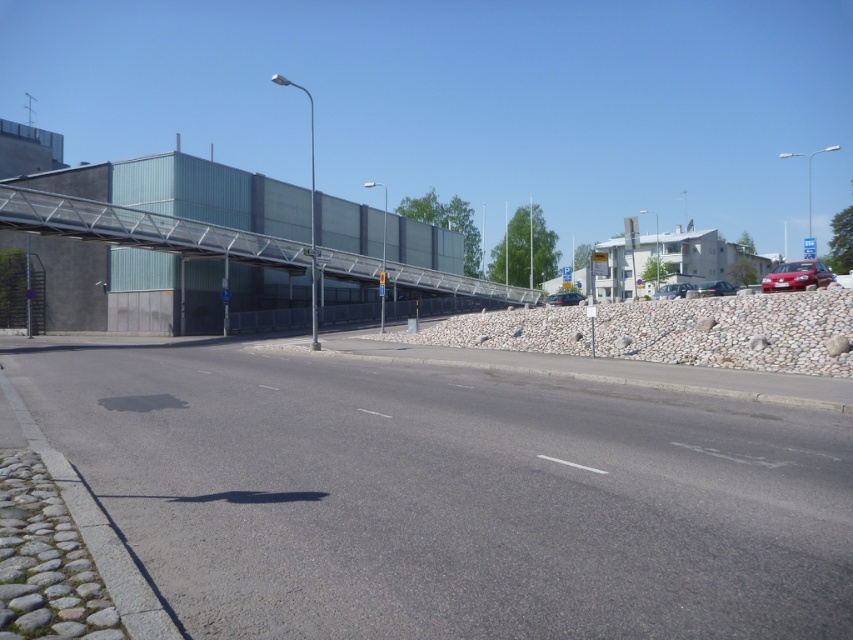
Is point (335, 276) positioned behind point (804, 257)?

No, it is in front of (804, 257).

Which of these two, metallic gray overpass at center or blue plastic sign at upper right, stands taller?

blue plastic sign at upper right

Is point (3, 216) farther from camera compared to point (810, 248)?

No.

At what (x,y) coordinates should I click in order to perform the action: click on metallic gray overpass at center. Please return your answer as a coordinate pair (x, y). This screenshot has height=640, width=853. Looking at the image, I should click on (143, 228).